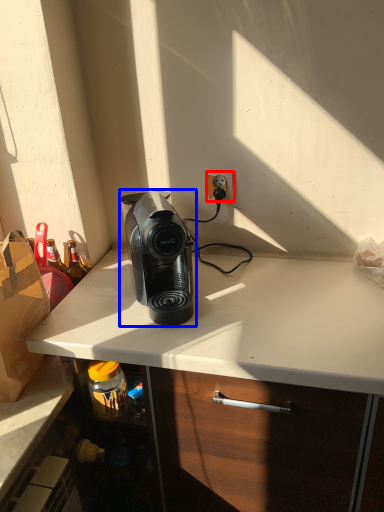
Question: Which object is closer to the camera taking this photo, power outlet (highlighted by a red box) or home appliance (highlighted by a blue box)?

Choices:
 (A) power outlet
 (B) home appliance

Answer: (B)